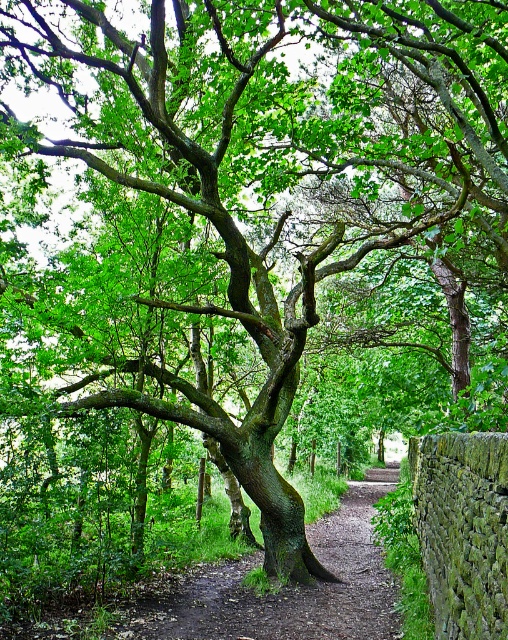
Question: Can you confirm if dirt path at center is positioned to the right of green mossy stone wall at lower right?

Choices:
 (A) yes
 (B) no

Answer: (B)

Question: Which point is closer to the camera?

Choices:
 (A) (451, 483)
 (B) (345, 628)

Answer: (A)

Question: Can you confirm if dirt path at center is positioned to the left of green mossy stone wall at lower right?

Choices:
 (A) no
 (B) yes

Answer: (B)

Question: Is dirt path at center positioned behind green mossy stone wall at lower right?

Choices:
 (A) yes
 (B) no

Answer: (A)